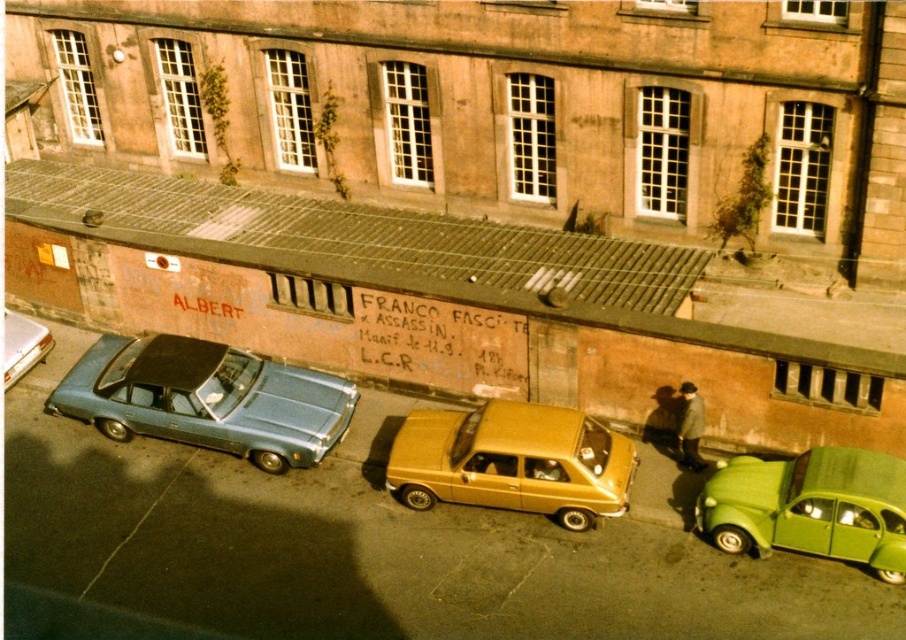
The image size is (906, 640). In order to click on matte blue sedan at left in this screenshot , I will do `click(206, 397)`.

Does matte blue sedan at left have a larger size compared to metallic blue sedan at left?

Yes, matte blue sedan at left is bigger than metallic blue sedan at left.

Locate an element on the screen. matte blue sedan at left is located at coordinates (206, 397).

From the picture: Is metallic gold sedan at center below metallic blue sedan at left?

Correct, metallic gold sedan at center is located below metallic blue sedan at left.

Which is in front, point (577, 477) or point (8, 348)?

Positioned in front is point (577, 477).

Who is more distant from viewer, (506, 420) or (22, 323)?

Positioned behind is point (22, 323).

Locate an element on the screen. This screenshot has width=906, height=640. metallic gold sedan at center is located at coordinates (513, 461).

Does green matte car at lower right have a greater width compared to metallic blue sedan at left?

Correct, the width of green matte car at lower right exceeds that of metallic blue sedan at left.

From the picture: Is green matte car at lower right in front of metallic blue sedan at left?

Yes.

Does point (863, 490) lie in front of point (20, 328)?

Yes, it is.

Where is `green matte car at lower right`? This screenshot has width=906, height=640. green matte car at lower right is located at coordinates 810,508.